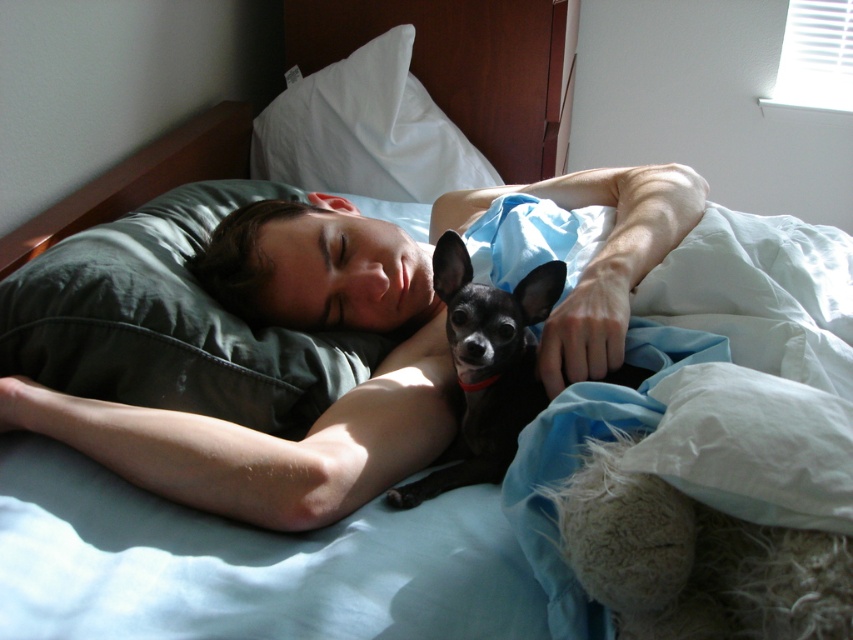
Can you confirm if green fabric pillow at upper center is taller than black smooth dog at center?

Indeed, green fabric pillow at upper center has a greater height compared to black smooth dog at center.

Which of these two, green fabric pillow at upper center or black smooth dog at center, stands taller?

With more height is green fabric pillow at upper center.

Between point (138, 326) and point (538, 280), which one is positioned behind?

The point (138, 326) is behind.

Where is `green fabric pillow at upper center`? The height and width of the screenshot is (640, 853). green fabric pillow at upper center is located at coordinates (170, 323).

Can you confirm if green fabric pillow at upper center is taller than white fabric pillow at upper center?

In fact, green fabric pillow at upper center may be shorter than white fabric pillow at upper center.

The height and width of the screenshot is (640, 853). I want to click on green fabric pillow at upper center, so click(170, 323).

Measure the distance between green fabric pillow at upper center and camera.

A distance of 76.90 centimeters exists between green fabric pillow at upper center and camera.

This screenshot has width=853, height=640. I want to click on green fabric pillow at upper center, so click(x=170, y=323).

Does matte green pillow at upper left appear on the right side of white fabric pillow at upper center?

Correct, you'll find matte green pillow at upper left to the right of white fabric pillow at upper center.

Can you confirm if matte green pillow at upper left is positioned below white fabric pillow at upper center?

Indeed, matte green pillow at upper left is positioned under white fabric pillow at upper center.

Image resolution: width=853 pixels, height=640 pixels. I want to click on matte green pillow at upper left, so click(x=318, y=417).